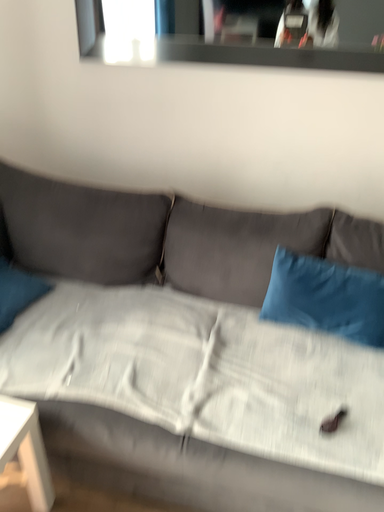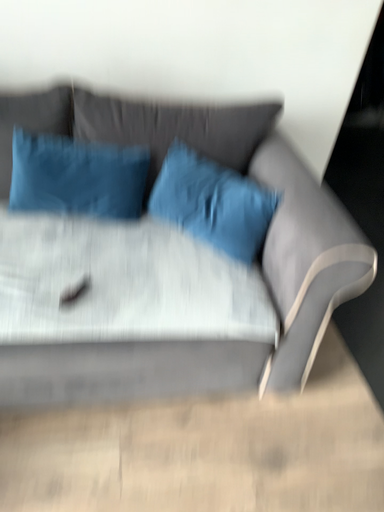
Question: How did the camera likely rotate when shooting the video?

Choices:
 (A) rotated downward
 (B) rotated upward

Answer: (A)